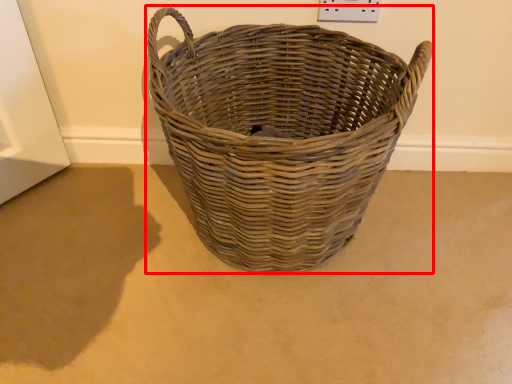
Question: Considering the relative positions of picnic basket (annotated by the red box) and plain in the image provided, where is picnic basket (annotated by the red box) located with respect to the staircase?

Choices:
 (A) right
 (B) left

Answer: (A)